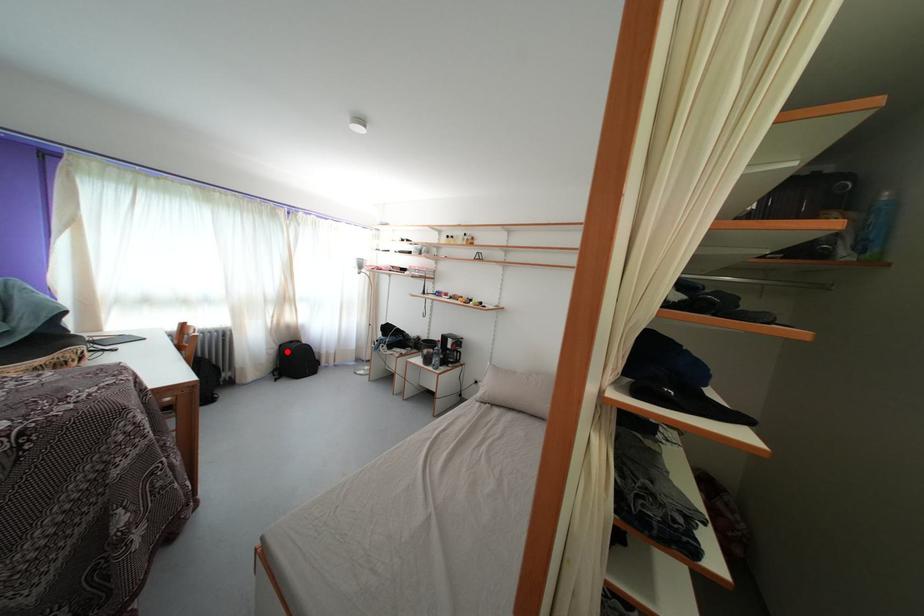
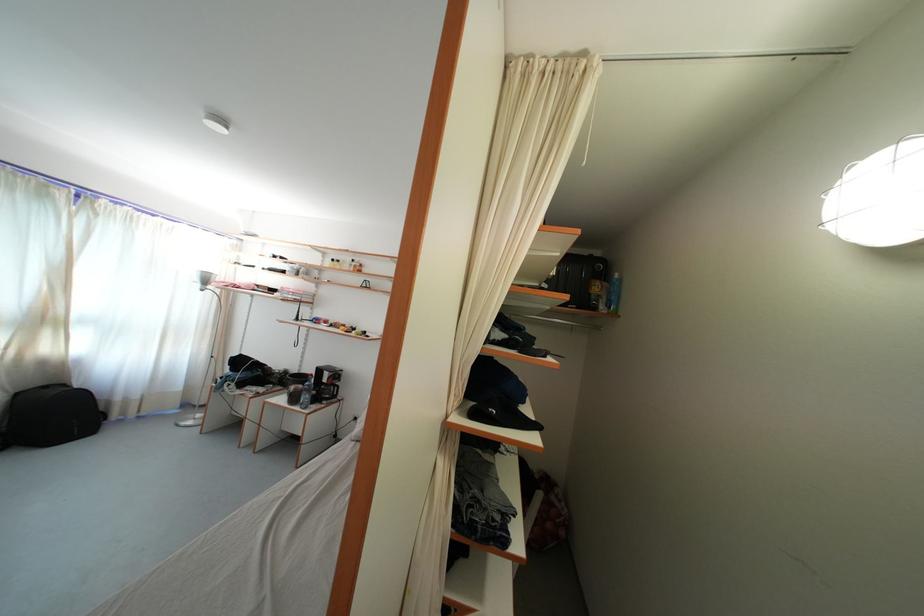
Question: I am providing you with two images of the same scene from different viewpoints. Image1 has a red point marked. In image2, the corresponding 3D location appears at what relative position? Reply with the corresponding letter.

Choices:
 (A) Closer
 (B) Farther

Answer: (B)